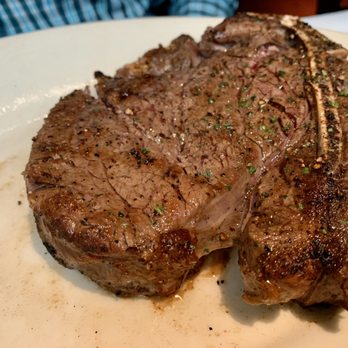
Find the location of a particular element. Image resolution: width=348 pixels, height=348 pixels. grease on plate is located at coordinates (163, 303).